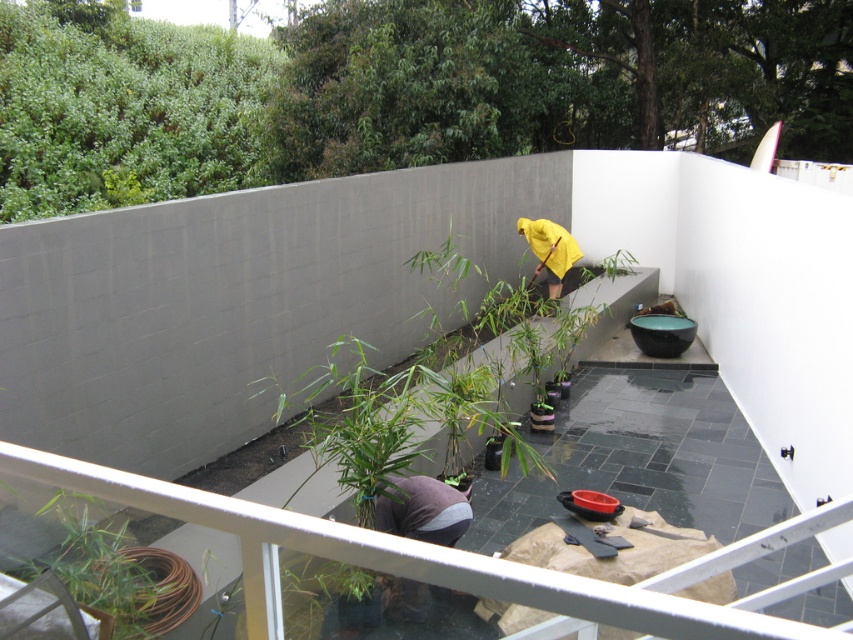
Which is in front, point (61, 42) or point (378, 515)?

Positioned in front is point (378, 515).

Is green leafy plant at upper center wider than gray fabric at lower center?

Yes.

Which is in front, point (30, 20) or point (444, 538)?

Point (444, 538)

Identify the location of green leafy plant at upper center. (467, 92).

Is point (396, 512) farther from camera compared to point (579, 252)?

No, it is in front of (579, 252).

Is gray fabric at lower center taller than yellow fabric at center?

No.

Who is more distant from viewer, (412, 476) or (552, 240)?

The point (552, 240) is more distant.

Locate an element on the screen. gray fabric at lower center is located at coordinates (422, 509).

Looking at this image, who is lower down, green leafy plant at upper center or yellow fabric at center?

yellow fabric at center is below.

Which is behind, point (407, 108) or point (558, 280)?

Positioned behind is point (407, 108).

Which is in front, point (73, 20) or point (534, 252)?

Point (534, 252)

At what (x,y) coordinates should I click in order to perform the action: click on green leafy plant at upper center. Please return your answer as a coordinate pair (x, y). Looking at the image, I should click on (467, 92).